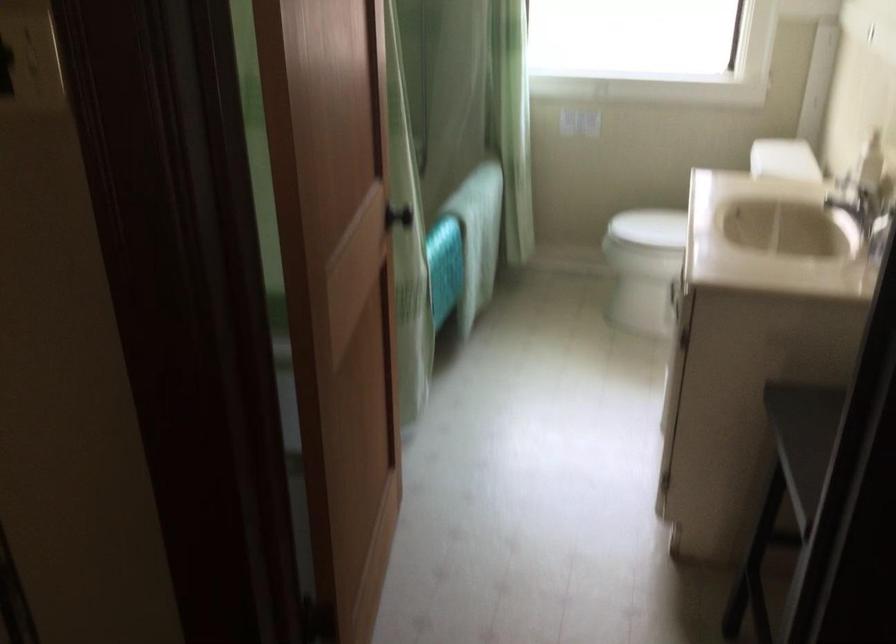
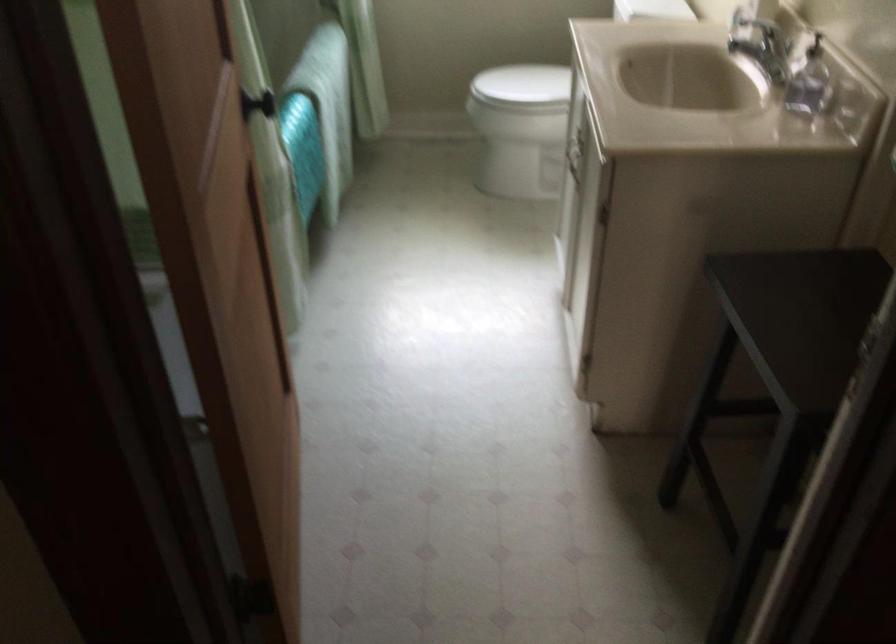
Locate, in the second image, the point that corresponds to the point at 656,223 in the first image.

(522, 84)